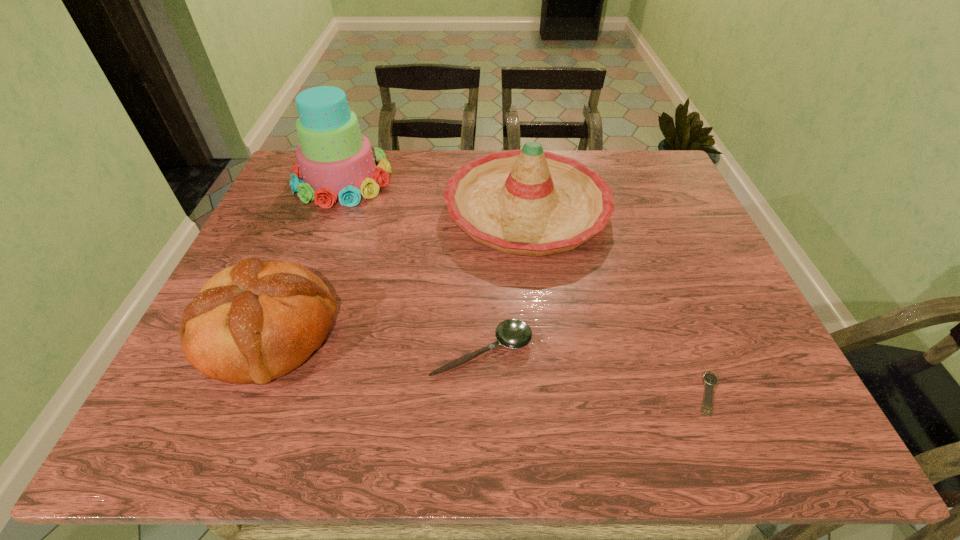
What are the coordinates of `cake` in the screenshot? It's located at (336, 162).

You are a GUI agent. You are given a task and a screenshot of the screen. Output one action in this format:
    pyautogui.click(x=<x>, y=<y>)
    Task: Click on the second tallest object
    
    Given the screenshot: What is the action you would take?
    click(531, 202)

The height and width of the screenshot is (540, 960). In order to click on the third tallest object in this screenshot , I will do `click(255, 321)`.

I want to click on the second shortest object, so click(512, 333).

Image resolution: width=960 pixels, height=540 pixels. In order to click on watch in this screenshot , I will do `click(710, 379)`.

Where is `the rightmost object`? The width and height of the screenshot is (960, 540). the rightmost object is located at coordinates (710, 379).

Image resolution: width=960 pixels, height=540 pixels. Identify the location of vacant space situated on the front of the cake. (316, 251).

Identify the location of vacant point located 0.370m on the front of the sombrero. (551, 406).

Locate an element on the screen. This screenshot has width=960, height=540. vacant space located on the right of the third shortest object is located at coordinates (434, 333).

Where is `vacant space located 0.120m on the back of the ladle`? Image resolution: width=960 pixels, height=540 pixels. vacant space located 0.120m on the back of the ladle is located at coordinates (482, 285).